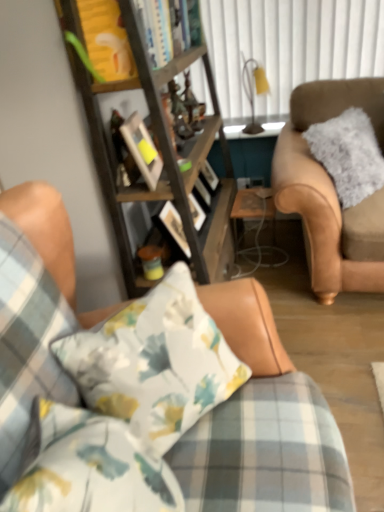
Question: From the image's perspective, is wooden picture frame at center located above or below matte brown coffee cup at center?

Choices:
 (A) above
 (B) below

Answer: (A)

Question: Considering the positions of wooden picture frame at center and matte brown coffee cup at center in the image, is wooden picture frame at center taller or shorter than matte brown coffee cup at center?

Choices:
 (A) tall
 (B) short

Answer: (A)

Question: Estimate the real-world distances between objects in this image. Which object is farther from the wooden picture frame at center?

Choices:
 (A) metallic gold lamp at upper right
 (B) floral fabric pillow at center
 (C) white textured curtain at upper center
 (D) floral fabric couch at center
 (E) fuzzy beige chair at right

Answer: (C)

Question: Considering the real-world distances, which object is closest to the floral fabric pillow at center?

Choices:
 (A) clear glass table at center
 (B) floral fabric couch at center
 (C) white textured curtain at upper center
 (D) fuzzy beige chair at right
 (E) metallic gold lamp at upper right

Answer: (B)